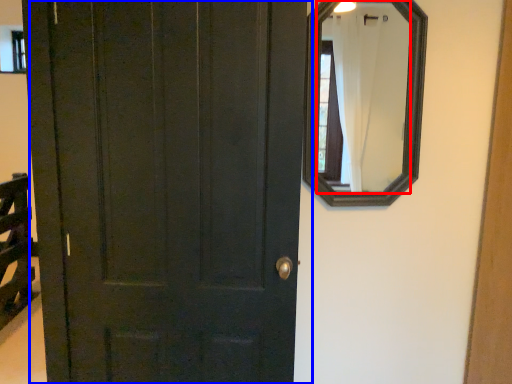
Question: Among these objects, which one is farthest to the camera, mirror (highlighted by a red box) or door (highlighted by a blue box)?

Choices:
 (A) mirror
 (B) door

Answer: (A)